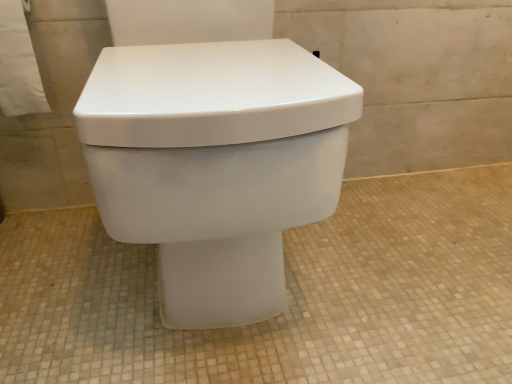
Question: Is white paper towel at upper left bigger than white matte toilet at center?

Choices:
 (A) no
 (B) yes

Answer: (A)

Question: From a real-world perspective, is white paper towel at upper left physically above white matte toilet at center?

Choices:
 (A) no
 (B) yes

Answer: (B)

Question: Is white paper towel at upper left aimed at white matte toilet at center?

Choices:
 (A) yes
 (B) no

Answer: (B)

Question: From the image's perspective, is white paper towel at upper left over white matte toilet at center?

Choices:
 (A) no
 (B) yes

Answer: (B)

Question: Is white paper towel at upper left touching white matte toilet at center?

Choices:
 (A) yes
 (B) no

Answer: (B)

Question: Is white paper towel at upper left positioned in front of white matte toilet at center?

Choices:
 (A) yes
 (B) no

Answer: (B)

Question: Considering the relative sizes of white glossy toilet at center and white matte toilet at center in the image provided, is white glossy toilet at center thinner than white matte toilet at center?

Choices:
 (A) no
 (B) yes

Answer: (B)

Question: Can you see white glossy toilet at center touching white matte toilet at center?

Choices:
 (A) yes
 (B) no

Answer: (B)

Question: From a real-world perspective, is white glossy toilet at center over white matte toilet at center?

Choices:
 (A) yes
 (B) no

Answer: (A)

Question: From the image's perspective, is white glossy toilet at center on top of white matte toilet at center?

Choices:
 (A) no
 (B) yes

Answer: (B)

Question: Is white glossy toilet at center further to the viewer compared to white matte toilet at center?

Choices:
 (A) yes
 (B) no

Answer: (B)

Question: Is white glossy toilet at center facing away from white matte toilet at center?

Choices:
 (A) yes
 (B) no

Answer: (B)

Question: Would you consider white paper towel at upper left to be distant from white glossy toilet at center?

Choices:
 (A) yes
 (B) no

Answer: (B)